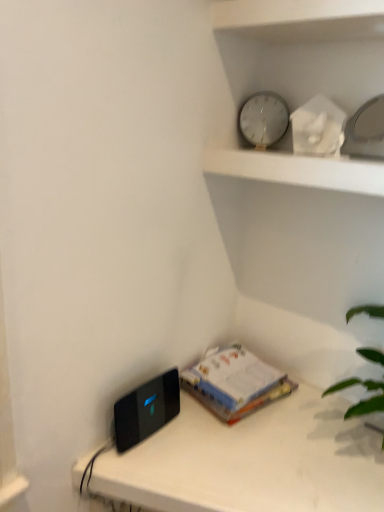
Find the location of `white glass clock at upper center`. white glass clock at upper center is located at coordinates [x=263, y=119].

The image size is (384, 512). What do you see at coordinates (234, 383) in the screenshot?
I see `white paper at center` at bounding box center [234, 383].

This screenshot has height=512, width=384. Describe the element at coordinates (251, 460) in the screenshot. I see `black plastic device at lower left` at that location.

At what (x,y) coordinates should I click in order to perform the action: click on metallic clock at upper center. Please return your answer as a coordinate pair (x, y). The height and width of the screenshot is (512, 384). Looking at the image, I should click on (299, 170).

I want to click on white glass clock at upper center, so click(263, 119).

Is white paper at center not inside metallic clock at upper center?

Result: That's correct, white paper at center is outside of metallic clock at upper center.

Which object is wider, white paper at center or metallic clock at upper center?

With larger width is metallic clock at upper center.

Considering the relative positions of white paper at center and metallic clock at upper center in the image provided, is white paper at center to the right of metallic clock at upper center from the viewer's perspective?

No.

Is white paper at center beside metallic clock at upper center?

→ No, white paper at center is not next to metallic clock at upper center.

Which of these two, white paper at center or black glossy ipod at lower left, stands shorter?

Standing shorter between the two is white paper at center.

From the image's perspective, between white paper at center and black glossy ipod at lower left, who is located below?

black glossy ipod at lower left appears lower in the image.

Is white paper at center situated inside black glossy ipod at lower left or outside?

white paper at center exists outside the volume of black glossy ipod at lower left.

Are white glass clock at upper center and black plastic device at lower left located far from each other?

No.

Does white glass clock at upper center have a larger size compared to black plastic device at lower left?

Actually, white glass clock at upper center might be smaller than black plastic device at lower left.

Is black plastic device at lower left not close to white glass clock at upper center?

That's not correct — black plastic device at lower left is a little close to white glass clock at upper center.

Looking at this image, is black plastic device at lower left oriented away from white glass clock at upper center?

No, white glass clock at upper center is not at the back of black plastic device at lower left.

Does black plastic device at lower left appear on the right side of white glass clock at upper center?

No, black plastic device at lower left is not to the right of white glass clock at upper center.

From the picture: Is black plastic device at lower left completely or partially outside of white glass clock at upper center?

Yes.

Considering the sizes of objects metallic clock at upper center and black plastic device at lower left in the image provided, who is thinner, metallic clock at upper center or black plastic device at lower left?

metallic clock at upper center is thinner.

You are a GUI agent. You are given a task and a screenshot of the screen. Output one action in this format:
    pyautogui.click(x=<x>, y=<y>)
    Task: Click on the desk in front of the metallic clock at upper center
    The height and width of the screenshot is (512, 384).
    Given the screenshot: What is the action you would take?
    251,460

Who is bigger, metallic clock at upper center or black plastic device at lower left?

black plastic device at lower left.

Would you say metallic clock at upper center is a long distance from black plastic device at lower left?

No, metallic clock at upper center is not far from black plastic device at lower left.

Is point (283, 174) closer or farther from the camera than point (162, 399)?

Clearly, point (283, 174) is closer to the camera than point (162, 399).

In the scene shown: Considering the relative positions of metallic clock at upper center and black glossy ipod at lower left in the image provided, is metallic clock at upper center to the left of black glossy ipod at lower left from the viewer's perspective?

No.

Considering the sizes of metallic clock at upper center and black glossy ipod at lower left in the image, is metallic clock at upper center bigger or smaller than black glossy ipod at lower left?

In the image, metallic clock at upper center appears to be larger than black glossy ipod at lower left.

From the image's perspective, relative to white paper at center, is metallic clock at upper center above or below?

metallic clock at upper center is above white paper at center.

Which is nearer, (225, 153) or (227, 391)?

Point (225, 153) is positioned closer to the camera compared to point (227, 391).

Is metallic clock at upper center facing away from white paper at center?

No, white paper at center is not at the back of metallic clock at upper center.

I want to click on paperback book on the left side of metallic clock at upper center, so click(234, 383).

The height and width of the screenshot is (512, 384). Identify the location of paperback book that is behind the metallic clock at upper center. (234, 383).

Image resolution: width=384 pixels, height=512 pixels. I want to click on ipod on the left of white paper at center, so click(146, 410).

When comparing their distances from black plastic device at lower left, does white glass clock at upper center or metallic clock at upper center seem closer?

Based on the image, metallic clock at upper center appears to be nearer to black plastic device at lower left.

From the image, which object appears to be farther from white paper at center, white glass clock at upper center or black plastic device at lower left?

white glass clock at upper center is further to white paper at center.

Based on their spatial positions, is black glossy ipod at lower left or black plastic device at lower left closer to white paper at center?

Based on the image, black plastic device at lower left appears to be nearer to white paper at center.

From the image, which object appears to be farther from white paper at center, metallic clock at upper center or black glossy ipod at lower left?

The object further to white paper at center is metallic clock at upper center.

From the image, which object appears to be farther from black glossy ipod at lower left, white paper at center or metallic clock at upper center?

metallic clock at upper center is further to black glossy ipod at lower left.

When comparing their distances from black plastic device at lower left, does black glossy ipod at lower left or white glass clock at upper center seem closer?

black glossy ipod at lower left is closer to black plastic device at lower left.

Based on their spatial positions, is white paper at center or black glossy ipod at lower left closer to white glass clock at upper center?

Based on the image, white paper at center appears to be nearer to white glass clock at upper center.

Estimate the real-world distances between objects in this image. Which object is closer to black glossy ipod at lower left, black plastic device at lower left or metallic clock at upper center?

black plastic device at lower left lies closer to black glossy ipod at lower left than the other object.

The image size is (384, 512). Identify the location of paperback book that lies between white glass clock at upper center and black glossy ipod at lower left from top to bottom. (234, 383).

This screenshot has width=384, height=512. I want to click on paperback book that lies between white glass clock at upper center and black plastic device at lower left from top to bottom, so click(234, 383).

Find the location of a particular element. paperback book between metallic clock at upper center and black glossy ipod at lower left from top to bottom is located at coordinates (234, 383).

Locate an element on the screen. The height and width of the screenshot is (512, 384). shelf that lies between white glass clock at upper center and black glossy ipod at lower left from top to bottom is located at coordinates (299, 170).